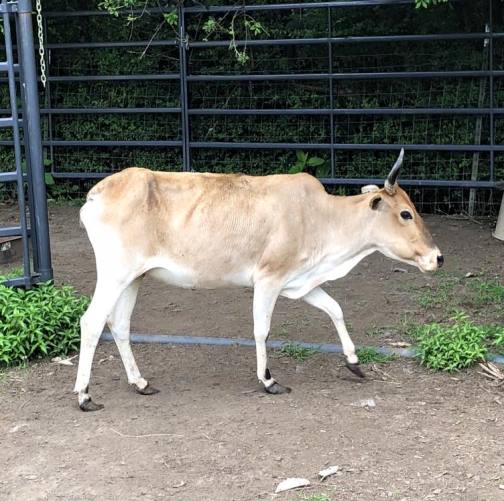
This screenshot has height=501, width=504. In order to click on iron in this screenshot , I will do `click(12, 102)`, `click(29, 96)`, `click(49, 78)`, `click(328, 87)`, `click(183, 72)`, `click(487, 84)`.